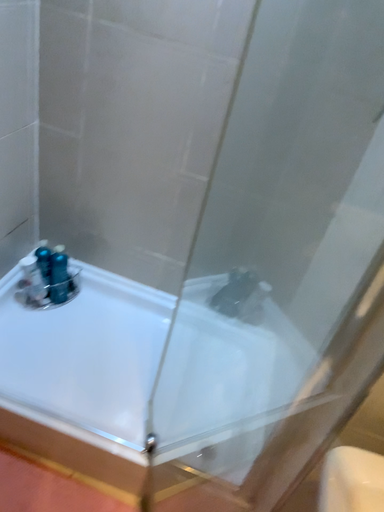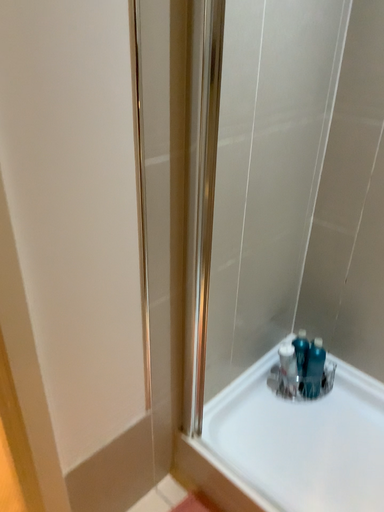
Question: How did the camera likely rotate when shooting the video?

Choices:
 (A) rotated upward
 (B) rotated downward

Answer: (A)